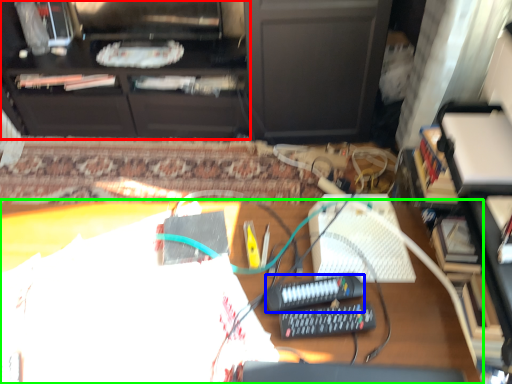
Question: Which object is positioned closest to furniture (highlighted by a red box)? Select from equipment (highlighted by a blue box) and desk (highlighted by a green box).

Choices:
 (A) equipment
 (B) desk

Answer: (B)